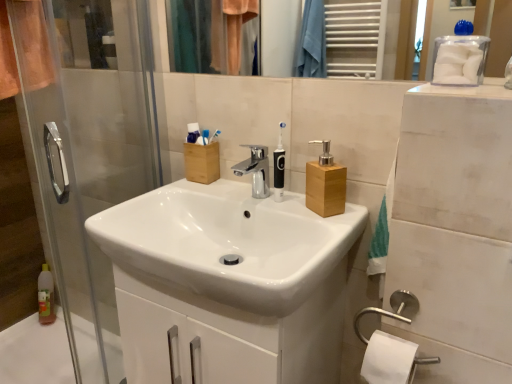
Question: Is wooden soap dispenser at center spatially inside satin nickel towel bar at lower right, or outside of it?

Choices:
 (A) inside
 (B) outside

Answer: (B)

Question: From the image's perspective, is wooden soap dispenser at center located above or below satin nickel towel bar at lower right?

Choices:
 (A) below
 (B) above

Answer: (B)

Question: Which is farther from the wooden soap dispenser at center?

Choices:
 (A) white plastic toothbrush at upper center, the 1th toothbrush positioned from the left
 (B) clear plastic bottle at lower left
 (C) black plastic toothbrush at upper center, marked as the 3th toothbrush in a front-to-back arrangement
 (D) satin nickel towel bar at lower right
 (E) black plastic toothbrush at center, the third toothbrush viewed from the left

Answer: (B)

Question: Which object is the closest to the transparent glass screen door at left?

Choices:
 (A) black plastic toothbrush at upper center, positioned as the second toothbrush in left-to-right order
 (B) wooden soap dispenser at center
 (C) satin nickel towel bar at lower right
 (D) white plastic toothbrush at upper center, which appears as the 2th toothbrush when viewed from the back
 (E) clear plastic bottle at lower left

Answer: (E)